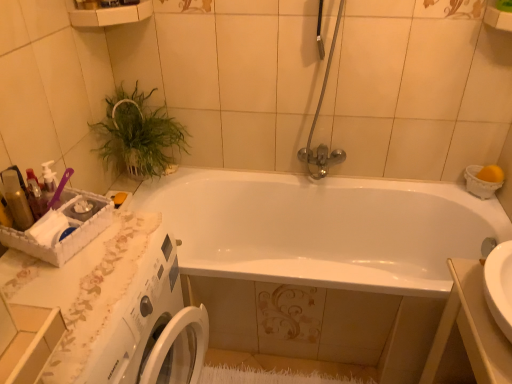
Locate an element on the screen. vacant area situated below chrome metallic shower door at upper center (from a real-world perspective) is located at coordinates (321, 180).